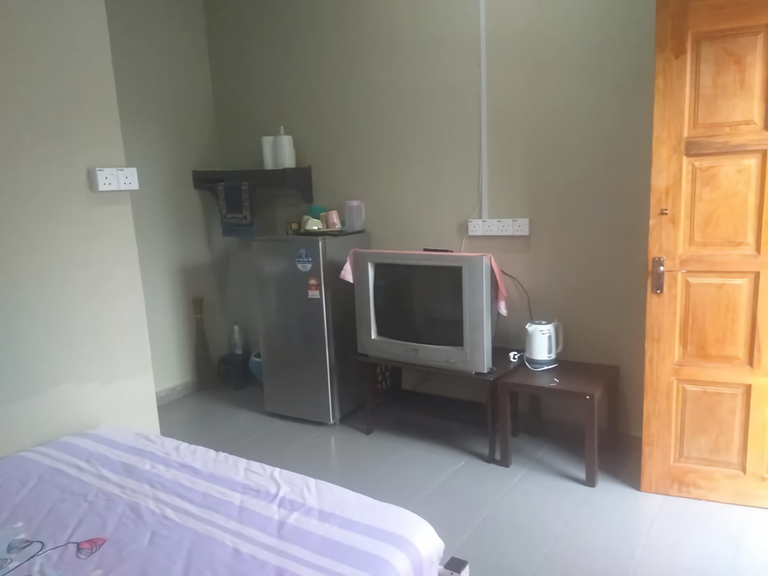
Where is `power outlets`? power outlets is located at coordinates (106, 172), (131, 183), (477, 228), (491, 230), (504, 230), (521, 226).